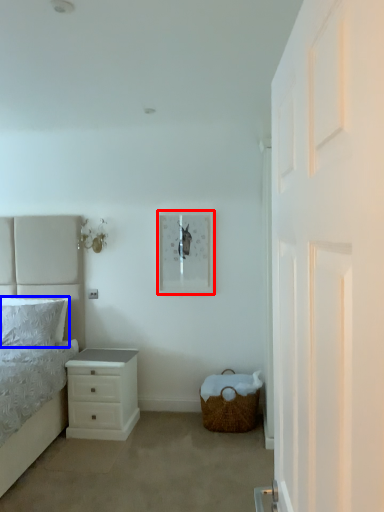
Question: Which object appears farthest to the camera in this image, picture frame (highlighted by a red box) or pillow (highlighted by a blue box)?

Choices:
 (A) picture frame
 (B) pillow

Answer: (A)